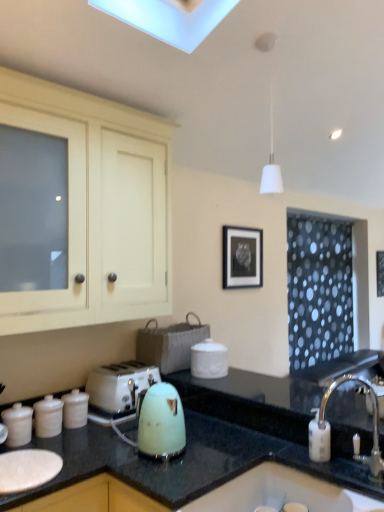
Question: Can you confirm if white plastic toaster at lower left is smaller than matte white canister at left, which is the third kitchen appliance in right-to-left order?

Choices:
 (A) no
 (B) yes

Answer: (A)

Question: Can you confirm if white plastic toaster at lower left is thinner than matte white canister at left, which is the 1th kitchen appliance from left to right?

Choices:
 (A) yes
 (B) no

Answer: (B)

Question: Can you confirm if white plastic toaster at lower left is positioned to the right of matte white canister at left, which is the third kitchen appliance in right-to-left order?

Choices:
 (A) yes
 (B) no

Answer: (A)

Question: Is white plastic toaster at lower left outside of matte white canister at left, which is the 1th kitchen appliance from left to right?

Choices:
 (A) yes
 (B) no

Answer: (A)

Question: Would you say white plastic toaster at lower left contains matte white canister at left, which is the third kitchen appliance in right-to-left order?

Choices:
 (A) yes
 (B) no

Answer: (B)

Question: Is white plastic toaster at lower left oriented away from matte white canister at left, which is the third kitchen appliance in right-to-left order?

Choices:
 (A) no
 (B) yes

Answer: (A)

Question: From the image's perspective, is white glossy canisters at lower left, which is the 2th kitchen appliance in left-to-right order, on black matte picture frame at upper center?

Choices:
 (A) no
 (B) yes

Answer: (A)

Question: From a real-world perspective, does white glossy canisters at lower left, placed as the 2th kitchen appliance when sorted from right to left, sit lower than black matte picture frame at upper center?

Choices:
 (A) no
 (B) yes

Answer: (B)

Question: Can you confirm if white glossy canisters at lower left, which is the 2th kitchen appliance in left-to-right order, is smaller than black matte picture frame at upper center?

Choices:
 (A) no
 (B) yes

Answer: (B)

Question: Is the depth of white glossy canisters at lower left, which is the 2th kitchen appliance in left-to-right order, less than that of black matte picture frame at upper center?

Choices:
 (A) yes
 (B) no

Answer: (A)

Question: Can you confirm if white glossy canisters at lower left, which is the 2th kitchen appliance in left-to-right order, is thinner than black matte picture frame at upper center?

Choices:
 (A) yes
 (B) no

Answer: (B)

Question: From a real-world perspective, is white glossy canisters at lower left, placed as the 2th kitchen appliance when sorted from right to left, located higher than black matte picture frame at upper center?

Choices:
 (A) yes
 (B) no

Answer: (B)

Question: Considering the relative sizes of white glossy sink at lower right and white plastic toaster at lower left in the image provided, is white glossy sink at lower right wider than white plastic toaster at lower left?

Choices:
 (A) yes
 (B) no

Answer: (A)